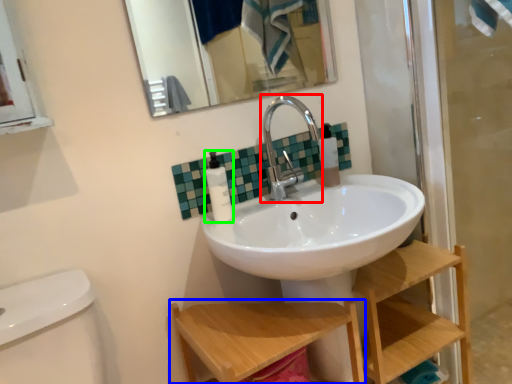
Question: Based on their relative distances, which object is nearer to tap (highlighted by a red box)? Choose from step stool (highlighted by a blue box) and toiletry (highlighted by a green box).

Choices:
 (A) step stool
 (B) toiletry

Answer: (B)